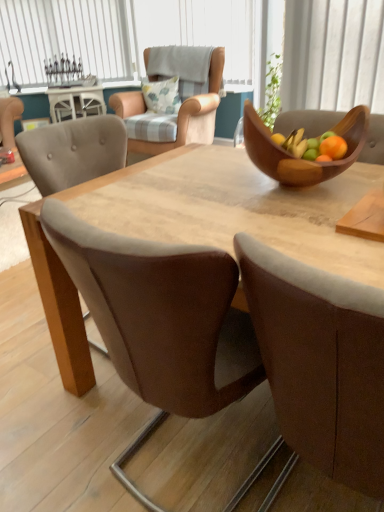
Find the location of a particular element. free region on the left part of wooden bowl at center is located at coordinates (206, 193).